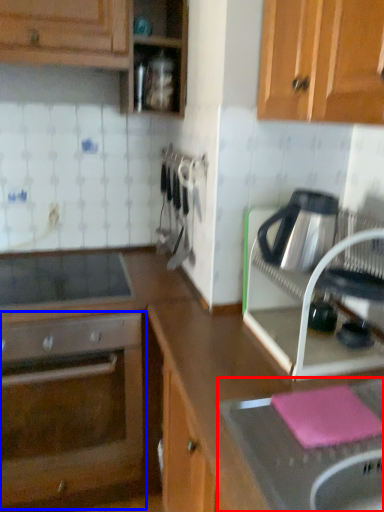
Question: Which object appears closest to the camera in this image, sink (highlighted by a red box) or oven (highlighted by a blue box)?

Choices:
 (A) sink
 (B) oven

Answer: (A)